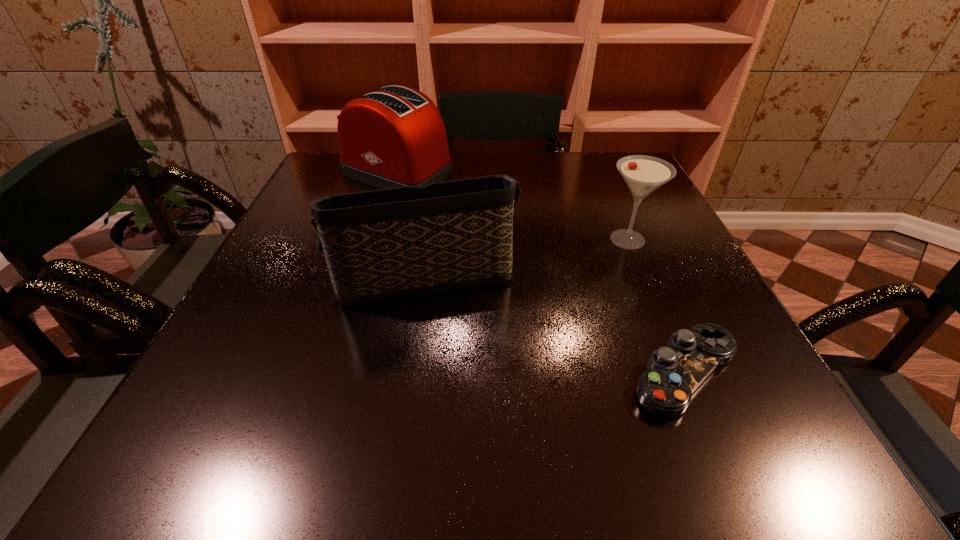
Where is `vacant space at the right edge`? The width and height of the screenshot is (960, 540). vacant space at the right edge is located at coordinates (626, 213).

I want to click on vacant space at the far right corner, so click(612, 186).

Where is `blank space at the near right corner`? blank space at the near right corner is located at coordinates (748, 429).

Identify the location of empty space between the handbag and the nearest object. Image resolution: width=960 pixels, height=540 pixels. (553, 324).

Find the location of `vacant region between the farthest object and the nearest object`. vacant region between the farthest object and the nearest object is located at coordinates pos(541,273).

You are a GUI agent. You are given a task and a screenshot of the screen. Output one action in this format:
    pyautogui.click(x=<x>, y=<y>)
    Task: Click on the free point between the martini and the nearest object
    
    Given the screenshot: What is the action you would take?
    pyautogui.click(x=657, y=306)

What are the coordinates of `unoccupied position between the control and the toaster` in the screenshot? It's located at (541, 273).

I want to click on unoccupied area between the shortest object and the farthest object, so click(541, 273).

Where is `vacant region between the shortest object and the handbag`? Image resolution: width=960 pixels, height=540 pixels. vacant region between the shortest object and the handbag is located at coordinates (553, 324).

Identify the location of vacant region between the shortest object and the third tallest object. This screenshot has height=540, width=960. (657, 306).